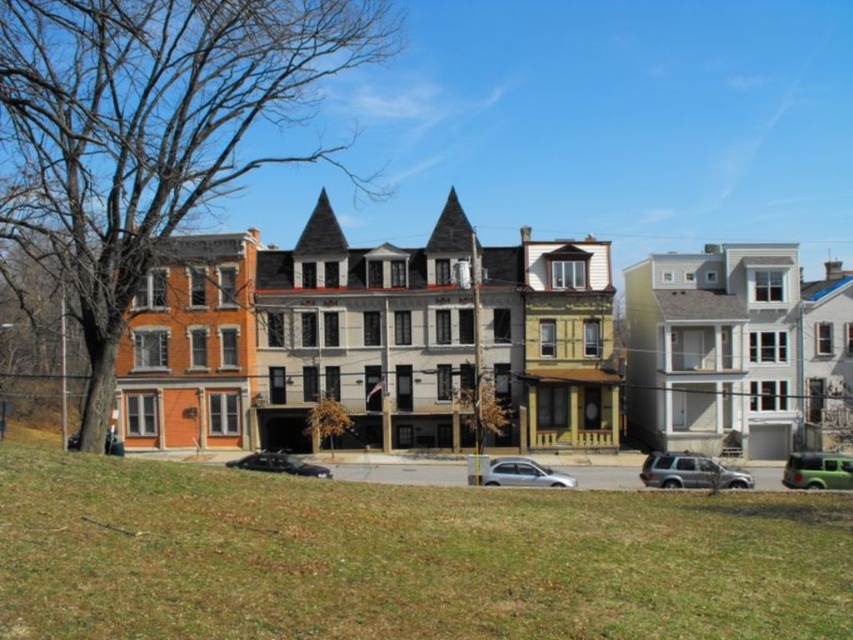
Question: Is silver metallic sedan at center behind black matte car at center?

Choices:
 (A) yes
 (B) no

Answer: (B)

Question: Among these objects, which one is farthest from the camera?

Choices:
 (A) black matte car at center
 (B) green grass at lower center
 (C) green matte car at lower right
 (D) silver metallic sedan at center

Answer: (A)

Question: Among these points, which one is nearest to the camera?

Choices:
 (A) (723, 476)
 (B) (253, 461)
 (C) (808, 476)
 (D) (793, 515)

Answer: (D)

Question: Which point is farther to the camera?

Choices:
 (A) (260, 468)
 (B) (819, 458)
 (C) (692, 460)
 (D) (537, 472)

Answer: (A)

Question: Can you confirm if satin silver suv at center is positioned below green matte car at lower right?

Choices:
 (A) no
 (B) yes

Answer: (A)

Question: Is satin silver suv at center positioned behind green matte car at lower right?

Choices:
 (A) yes
 (B) no

Answer: (B)